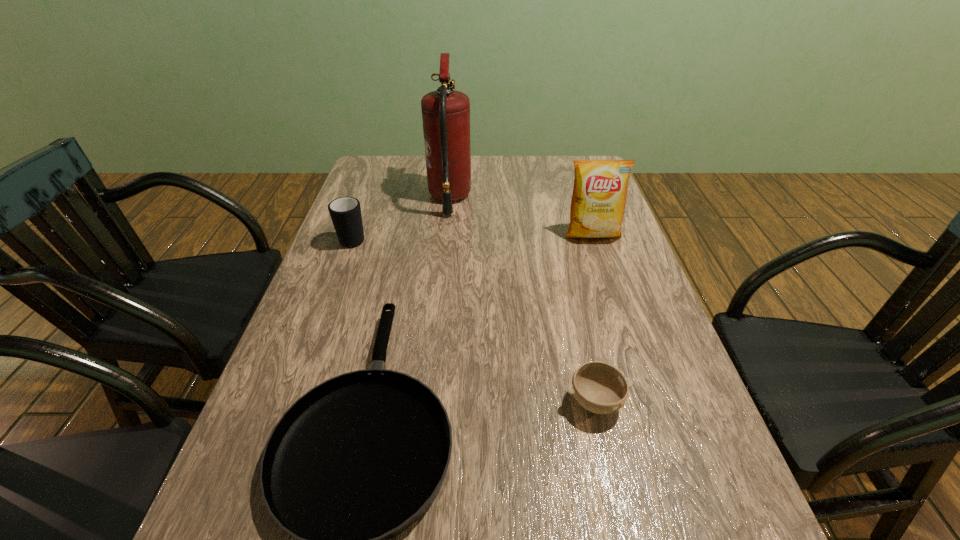
The height and width of the screenshot is (540, 960). Find the location of `the tallest object`. the tallest object is located at coordinates (445, 112).

Where is `fire extinguisher`? fire extinguisher is located at coordinates (445, 112).

Identify the location of crisp (potato chip). This screenshot has height=540, width=960. (598, 201).

You are a GUI agent. You are given a task and a screenshot of the screen. Output one action in this format:
    pyautogui.click(x=<x>, y=<y>)
    Task: Click on the third shortest object
    Image resolution: width=960 pixels, height=540 pixels.
    Given the screenshot: What is the action you would take?
    click(345, 212)

Identify the location of the fourth tallest object. The image size is (960, 540). (x=600, y=388).

Where is `vacant space located 0.280m at the front of the tallest object where the nozzle is aimed`? The width and height of the screenshot is (960, 540). vacant space located 0.280m at the front of the tallest object where the nozzle is aimed is located at coordinates (558, 198).

Locate an element on the screen. This screenshot has height=540, width=960. free location located on the front-facing side of the second tallest object is located at coordinates (611, 291).

In order to click on vacant region located 0.100m on the side of the mug with the handle in this screenshot , I will do `click(365, 207)`.

Where is `blank space located on the side of the mug with the handle`? Image resolution: width=960 pixels, height=540 pixels. blank space located on the side of the mug with the handle is located at coordinates (378, 170).

The height and width of the screenshot is (540, 960). What are the coordinates of `vacant area situated on the side of the mug with the handle` in the screenshot? It's located at point(372,188).